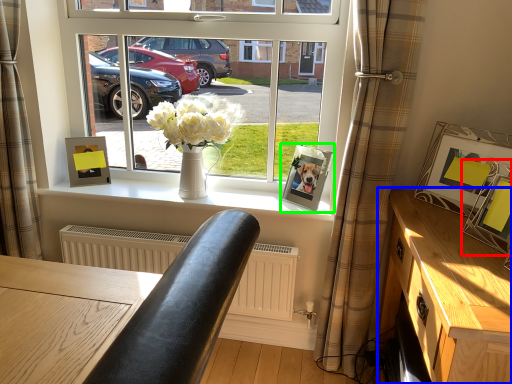
Question: Which object is the closest to the picture frame (highlighted by a red box)? Choose among these: table (highlighted by a blue box) or picture frame (highlighted by a green box).

Choices:
 (A) table
 (B) picture frame

Answer: (A)